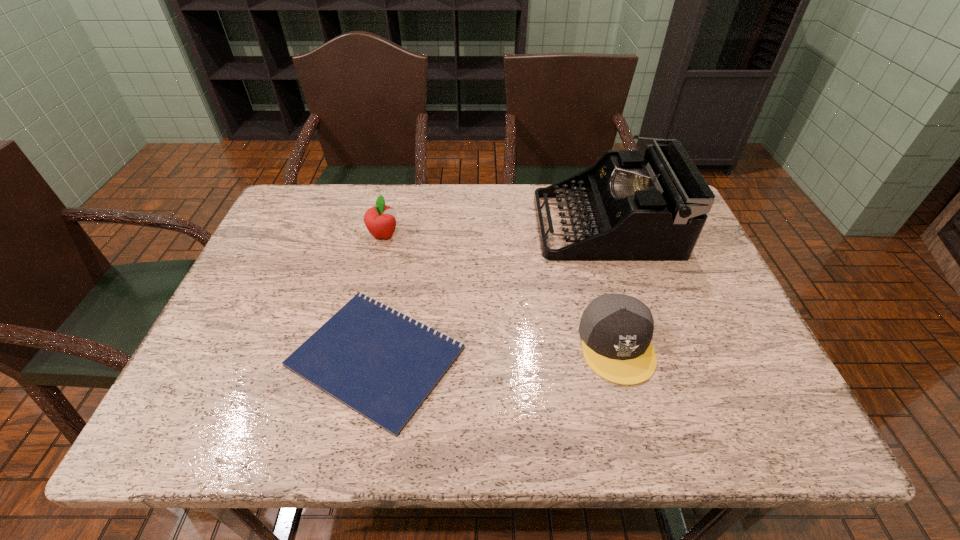
Where is `vacant area between the apple and the tallest object`? The width and height of the screenshot is (960, 540). vacant area between the apple and the tallest object is located at coordinates (494, 230).

Locate an element on the screen. vacant point located between the cap and the notepad is located at coordinates (496, 351).

Locate an element on the screen. This screenshot has width=960, height=540. empty space that is in between the typewriter and the apple is located at coordinates (494, 230).

Locate an element on the screen. The width and height of the screenshot is (960, 540). empty location between the shortest object and the typewriter is located at coordinates (491, 291).

Image resolution: width=960 pixels, height=540 pixels. Identify the location of free spot between the tallest object and the shortest object. (491, 291).

The height and width of the screenshot is (540, 960). In order to click on blank region between the typewriter and the shortest object in this screenshot , I will do `click(491, 291)`.

You are a GUI agent. You are given a task and a screenshot of the screen. Output one action in this format:
    pyautogui.click(x=<x>, y=<y>)
    Task: Click on the free spot between the shortest object and the cap
    
    Given the screenshot: What is the action you would take?
    pyautogui.click(x=496, y=351)

Find the location of a particular element. This screenshot has width=960, height=540. vacant space that is in between the cap and the typewriter is located at coordinates (611, 285).

This screenshot has width=960, height=540. Find the location of `vacant point located between the typewriter and the second shortest object`. vacant point located between the typewriter and the second shortest object is located at coordinates (611, 285).

Locate an element on the screen. unoccupied area between the cap and the tallest object is located at coordinates (611, 285).